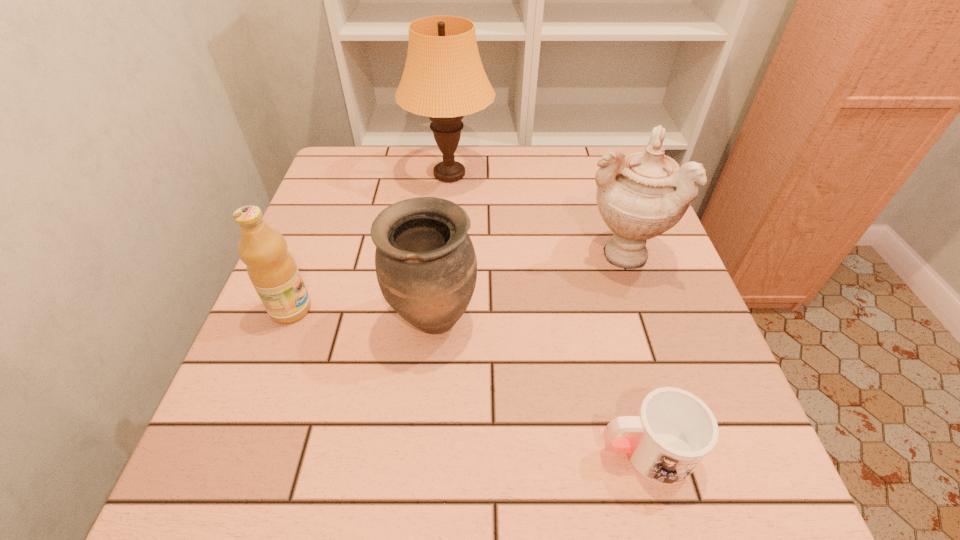
Identify the location of lampshade. (444, 79).

The height and width of the screenshot is (540, 960). What are the coordinates of `the farthest object` in the screenshot? It's located at (444, 79).

Where is `the right urn`? The height and width of the screenshot is (540, 960). the right urn is located at coordinates (641, 195).

Identify the location of the farther urn. The height and width of the screenshot is (540, 960). (x=641, y=195).

Where is `the left urn`? the left urn is located at coordinates (426, 266).

Where is `the nearer urn`? The width and height of the screenshot is (960, 540). the nearer urn is located at coordinates (426, 266).

Locate an element on the screen. This screenshot has width=960, height=540. the leftmost object is located at coordinates (272, 270).

Locate an element on the screen. Image resolution: width=960 pixels, height=540 pixels. the nearest object is located at coordinates (673, 431).

At what (x,y) coordinates should I click in order to perform the action: click on the shortest object. Please return your answer as a coordinate pair (x, y). Looking at the image, I should click on (673, 431).

What are the coordinates of `vacant space situated on the right of the farthest object` in the screenshot? It's located at (574, 174).